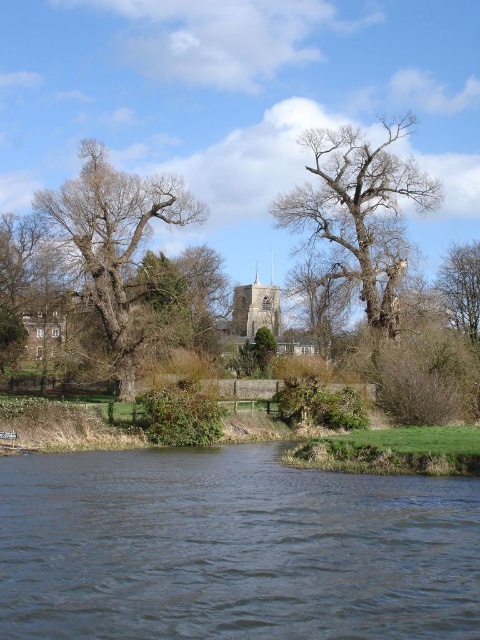
Question: Which point is farther from the camera taking this photo?

Choices:
 (A) (464, 244)
 (B) (149, 182)

Answer: (A)

Question: Does bare wood tree at upper center come behind smooth bark tree at left?

Choices:
 (A) yes
 (B) no

Answer: (A)

Question: Which of the following is the closest to the observer?

Choices:
 (A) (x=320, y=532)
 (B) (x=452, y=253)
 (C) (x=110, y=250)

Answer: (A)

Question: Does bare wood tree at upper center appear on the left side of smooth bark tree at left?

Choices:
 (A) yes
 (B) no

Answer: (B)

Question: Among these objects, which one is nearest to the camera?

Choices:
 (A) brown textured tree at upper right
 (B) bare wood tree at upper center
 (C) smooth bark tree at left

Answer: (C)

Question: Does dark blue water at center come in front of brown textured tree at upper right?

Choices:
 (A) no
 (B) yes

Answer: (B)